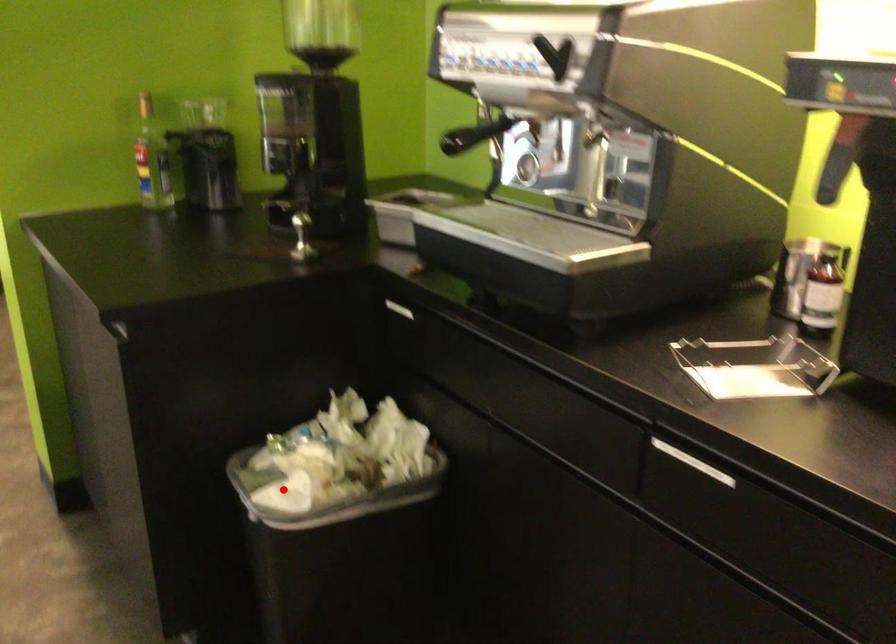
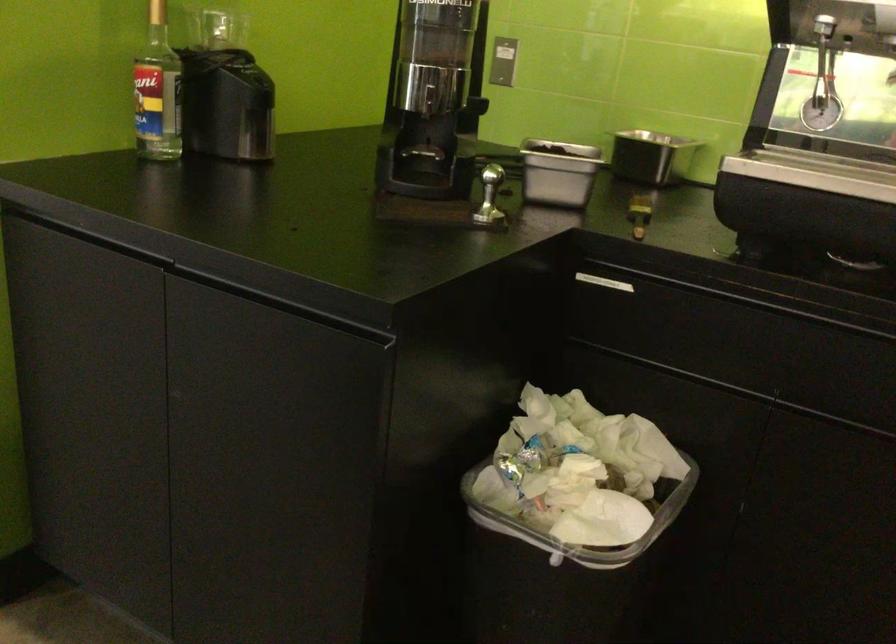
Question: I am providing you with two images of the same scene from different viewpoints. A red point is shown in image1. For the corresponding object point in image2, is it positioned nearer or farther from the camera?

Choices:
 (A) Nearer
 (B) Farther

Answer: (A)